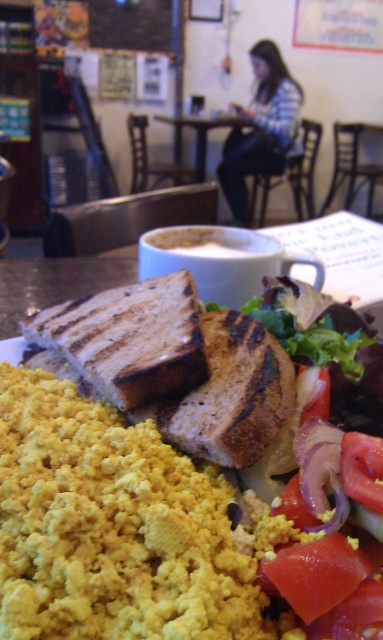
The height and width of the screenshot is (640, 383). Identify the location of white matte cup at center. (211, 241).

Is white matte cup at center to the left of white ceramic cup at upper center from the viewer's perspective?

Correct, you'll find white matte cup at center to the left of white ceramic cup at upper center.

The image size is (383, 640). In order to click on white matte cup at center in this screenshot , I will do `click(211, 241)`.

The height and width of the screenshot is (640, 383). In order to click on white matte cup at center in this screenshot , I will do `click(211, 241)`.

Based on the photo, does grilled bread at center have a lesser height compared to white matte cup at center?

No.

Is point (130, 314) less distant than point (258, 234)?

Yes, it is.

Is point (42, 336) closer to viewer compared to point (186, 236)?

Yes, point (42, 336) is in front of point (186, 236).

The image size is (383, 640). I want to click on grilled bread at center, so (x=129, y=339).

Is grilled bread at center to the left of white ceramic cup at upper center from the viewer's perspective?

Correct, you'll find grilled bread at center to the left of white ceramic cup at upper center.

Is grilled bread at center smaller than white ceramic cup at upper center?

Correct, grilled bread at center occupies less space than white ceramic cup at upper center.

Find the location of a particular element. This screenshot has height=640, width=383. grilled bread at center is located at coordinates (129, 339).